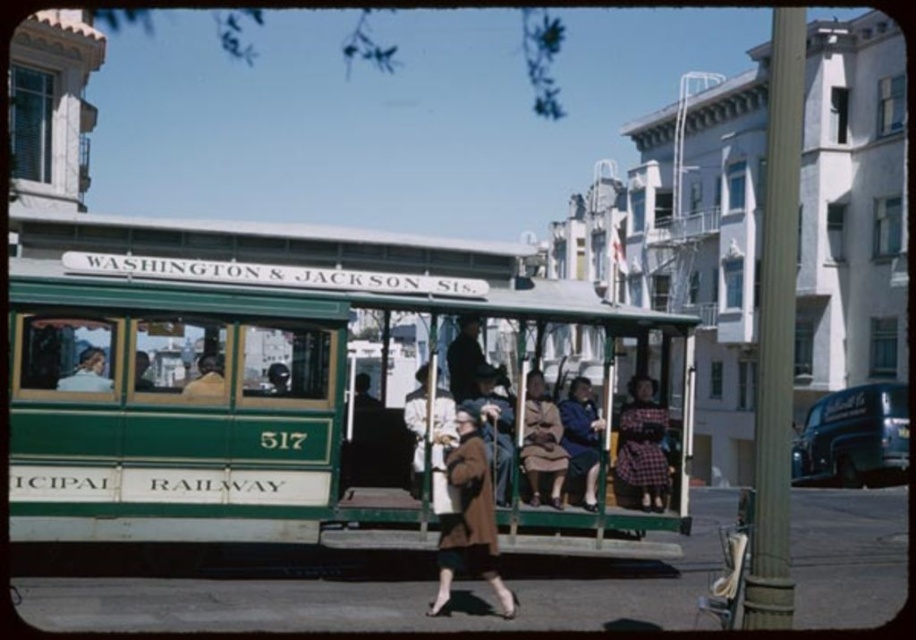
Does brown wool coat at center appear over plaid fabric dress at center?

No.

Is brown wool coat at center to the right of plaid fabric dress at center from the viewer's perspective?

No, brown wool coat at center is not to the right of plaid fabric dress at center.

Where is `brown wool coat at center`? The width and height of the screenshot is (916, 640). brown wool coat at center is located at coordinates (469, 516).

Is green polished wood cable car at center smaller than shiny dark blue van at right?

No.

Which of these two, green polished wood cable car at center or shiny dark blue van at right, stands shorter?

shiny dark blue van at right

Who is more distant from viewer, (x=235, y=291) or (x=798, y=481)?

Point (x=798, y=481)

The image size is (916, 640). Identify the location of green polished wood cable car at center. (231, 396).

Does green polished wood cable car at center appear under brown fabric coat at center?

No, green polished wood cable car at center is not below brown fabric coat at center.

Is green polished wood cable car at center positioned in front of brown fabric coat at center?

Yes, green polished wood cable car at center is in front of brown fabric coat at center.

Who is more distant from viewer, (354,420) or (544,429)?

The point (354,420) is more distant.

At what (x,y) coordinates should I click in order to perform the action: click on green polished wood cable car at center. Please return your answer as a coordinate pair (x, y). This screenshot has width=916, height=640. Looking at the image, I should click on (231, 396).